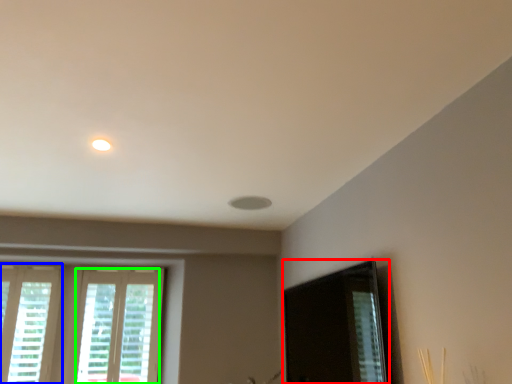
Question: Estimate the real-world distances between objects in this image. Which object is closer to screen door (highlighted by a red box), window (highlighted by a blue box) or window (highlighted by a green box)?

Choices:
 (A) window
 (B) window

Answer: (B)